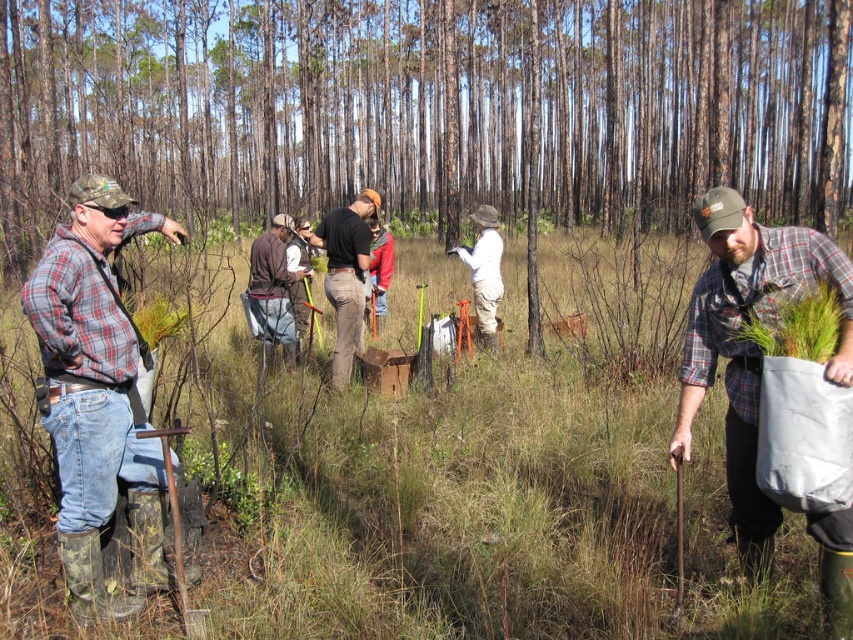
Question: Which of the following is the closest to the observer?

Choices:
 (A) (544, 618)
 (B) (236, 42)
 (C) (337, 356)

Answer: (A)

Question: Which point is closer to the camera taking this photo?

Choices:
 (A) (265, 333)
 (B) (325, 275)
 (C) (306, 593)
 (D) (751, 429)

Answer: (D)

Question: Is brown wood tree at center smaller than plaid flannel shirt at center?

Choices:
 (A) no
 (B) yes

Answer: (A)

Question: Where is green grass at center located in relation to plaid flannel shirt at center in the image?

Choices:
 (A) right
 (B) left

Answer: (B)

Question: Which point is farther from the camera taking this photo?

Choices:
 (A) (341, 275)
 (B) (677, 289)

Answer: (B)

Question: Can you confirm if green grass at center is wider than brown leather pants at center?

Choices:
 (A) no
 (B) yes

Answer: (B)